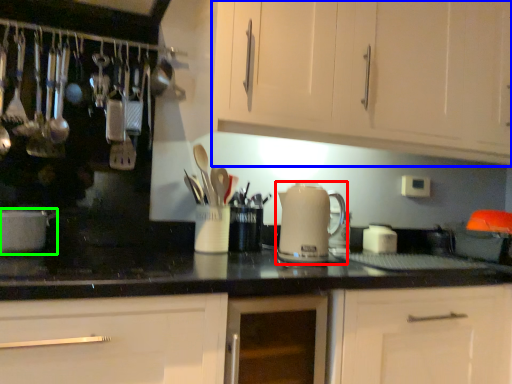
Question: Which object is the farthest from kitchen appliance (highlighted by a red box)? Choose among these: cabinetry (highlighted by a blue box) or home appliance (highlighted by a green box).

Choices:
 (A) cabinetry
 (B) home appliance

Answer: (B)